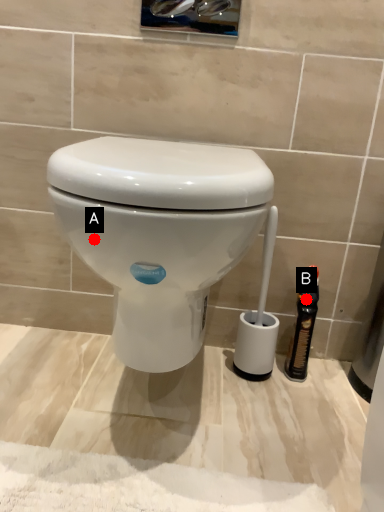
Question: Two points are circled on the image, labeled by A and B beside each circle. Which point is farther from the camera taking this photo?

Choices:
 (A) A is further
 (B) B is further

Answer: (B)